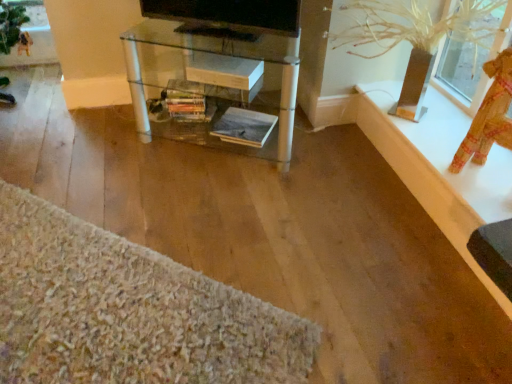
Question: From a real-world perspective, relative to textured beige rug at lower left, is textured fabric doll at upper right vertically above or below?

Choices:
 (A) above
 (B) below

Answer: (A)

Question: Considering the positions of point (490, 135) and point (224, 296), is point (490, 135) closer or farther from the camera than point (224, 296)?

Choices:
 (A) closer
 (B) farther

Answer: (B)

Question: Which object is positioned farthest from the black glossy tv at upper center?

Choices:
 (A) textured beige rug at lower left
 (B) clear glass table at center
 (C) textured fabric doll at upper right
 (D) white glossy ledge at upper right
 (E) clear plastic vase at upper right

Answer: (A)

Question: Estimate the real-world distances between objects in this image. Which object is farther from the textured fabric doll at upper right?

Choices:
 (A) clear glass table at center
 (B) white glossy ledge at upper right
 (C) clear plastic vase at upper right
 (D) textured beige rug at lower left
 (E) black glossy tv at upper center

Answer: (D)